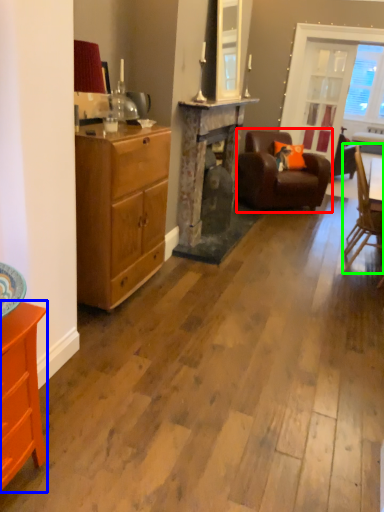
Question: Which object is positioned farthest from chair (highlighted by a red box)? Select from cabinetry (highlighted by a blue box) and chair (highlighted by a green box).

Choices:
 (A) cabinetry
 (B) chair

Answer: (A)